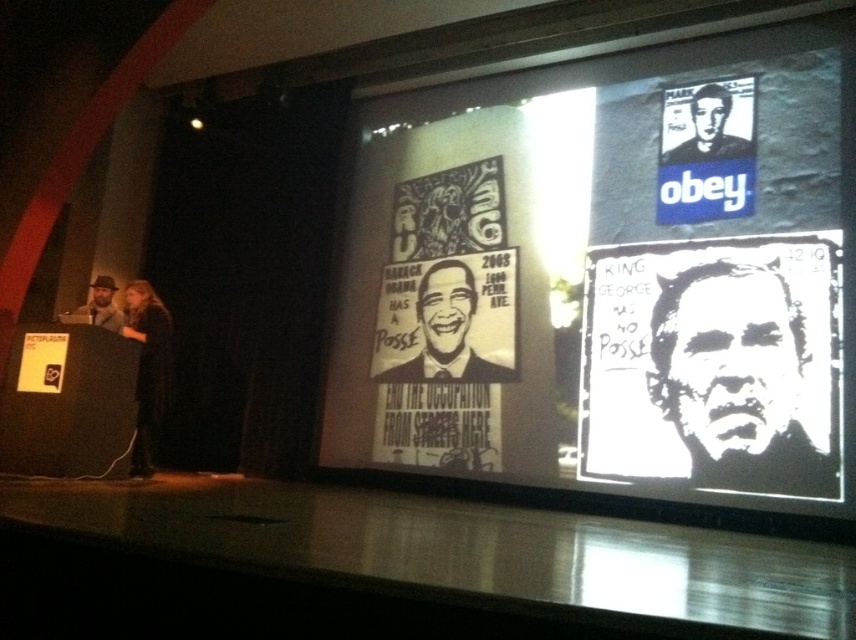
Is black paper poster at center further to camera compared to black paper at upper center?

That is True.

Which is more to the right, black paper poster at center or black paper at upper center?

black paper at upper center is more to the right.

Does point (465, 285) come closer to viewer compared to point (709, 118)?

No, (465, 285) is behind (709, 118).

Identify the location of black paper poster at center. (446, 332).

Does black paper poster at center appear over black fabric dress at left?

Correct, black paper poster at center is located above black fabric dress at left.

Is point (447, 260) positioned after point (134, 320)?

Yes, it is.

Which is in front, point (424, 301) or point (152, 324)?

Point (152, 324)

You are a GUI agent. You are given a task and a screenshot of the screen. Output one action in this format:
    pyautogui.click(x=<x>, y=<y>)
    Task: Click on the black paper poster at center
    
    Given the screenshot: What is the action you would take?
    pyautogui.click(x=446, y=332)

Does point (738, 336) come closer to viewer compared to point (693, 99)?

Yes, it is in front of point (693, 99).

Between point (687, 448) and point (693, 102), which one is positioned in front?

Point (687, 448) is in front.

Does point (702, 307) lie in front of point (710, 83)?

Yes, it is.

The width and height of the screenshot is (856, 640). Identify the location of white paper at center. pos(736,380).